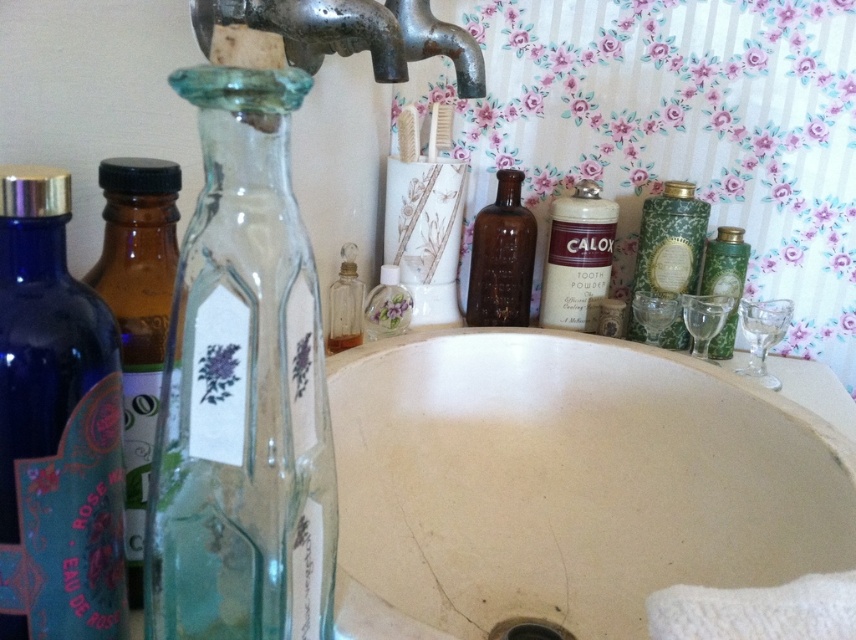
Question: Is green matte powder container at upper right closer to camera compared to transparent glass soap dispenser at center?

Choices:
 (A) yes
 (B) no

Answer: (B)

Question: Estimate the real-world distances between objects in this image. Which object is closer to the rusty metal faucet at upper center?

Choices:
 (A) blue glass bottle at left
 (B) transparent glass bottle at left

Answer: (B)

Question: Based on their relative distances, which object is nearer to the brown glass bottle at center?

Choices:
 (A) transparent glass soap dispenser at center
 (B) rusty metal faucet at upper center

Answer: (A)

Question: Which is farther from the green matte powder container at upper right?

Choices:
 (A) green glass bottle at upper right
 (B) beige ceramic sink at center

Answer: (B)

Question: Where is beige ceramic sink at center located in relation to green glass bottle at upper right in the image?

Choices:
 (A) right
 (B) left

Answer: (B)

Question: Does transparent glass bottle at left appear on the left side of green matte powder container at upper right?

Choices:
 (A) yes
 (B) no

Answer: (A)